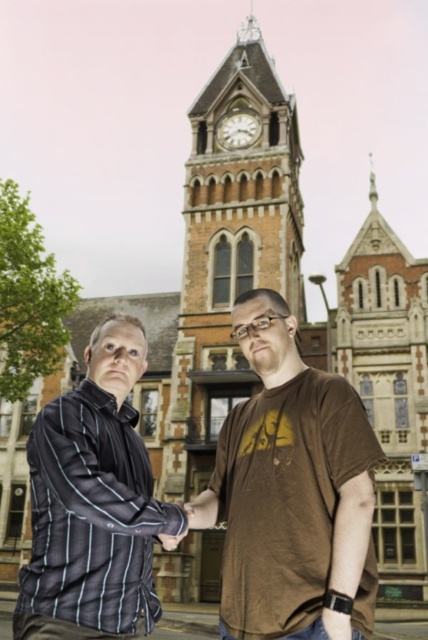
Question: Does brown cotton t-shirt at center appear on the right side of black pinstripe shirt at left?

Choices:
 (A) yes
 (B) no

Answer: (A)

Question: Is the position of brown cotton t-shirt at center less distant than that of black pinstripe shirt at left?

Choices:
 (A) no
 (B) yes

Answer: (B)

Question: Does brown cotton t-shirt at center appear under black pinstripe shirt at left?

Choices:
 (A) yes
 (B) no

Answer: (B)